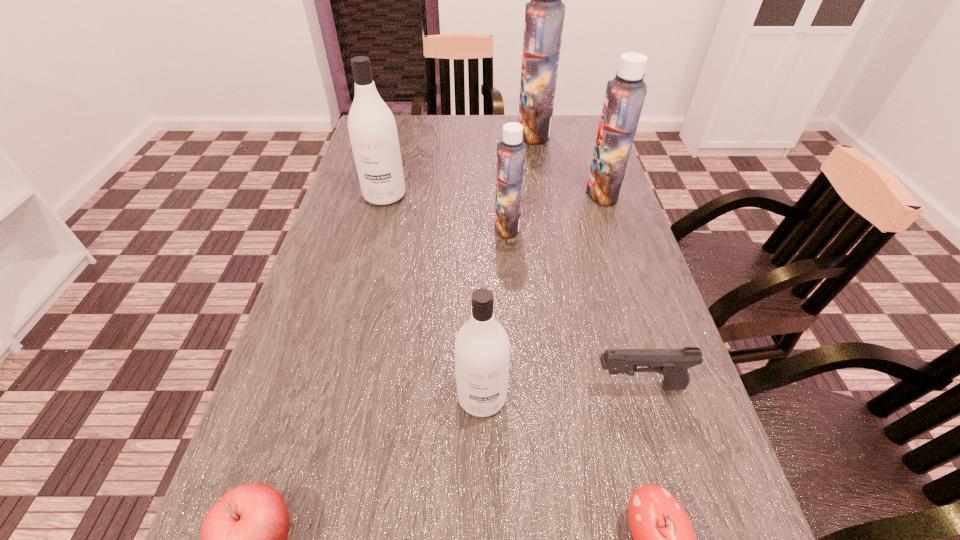
The width and height of the screenshot is (960, 540). Find the location of `the tallest shampoo`. the tallest shampoo is located at coordinates (544, 15).

The image size is (960, 540). Find the location of `the biggest blue shampoo`. the biggest blue shampoo is located at coordinates (544, 15).

This screenshot has width=960, height=540. I want to click on the rightmost blue shampoo, so click(x=624, y=98).

Locate an element on the screen. Image resolution: width=960 pixels, height=540 pixels. the second biggest blue shampoo is located at coordinates (624, 98).

Find the location of a particular element. The image size is (960, 540). the left white shampoo is located at coordinates (372, 129).

What are the coordinates of `the farther white shampoo` in the screenshot? It's located at (372, 129).

You are a GUI agent. You are given a task and a screenshot of the screen. Output one action in this format:
    pyautogui.click(x=<x>, y=<y>)
    Task: Click on the fifth nearest object
    
    Given the screenshot: What is the action you would take?
    pyautogui.click(x=511, y=152)

I want to click on the leftmost blue shampoo, so click(x=511, y=152).

Where is `the nearest shampoo`? The width and height of the screenshot is (960, 540). the nearest shampoo is located at coordinates (482, 349).

Locate an element on the screen. The width and height of the screenshot is (960, 540). the nearer white shampoo is located at coordinates (482, 349).